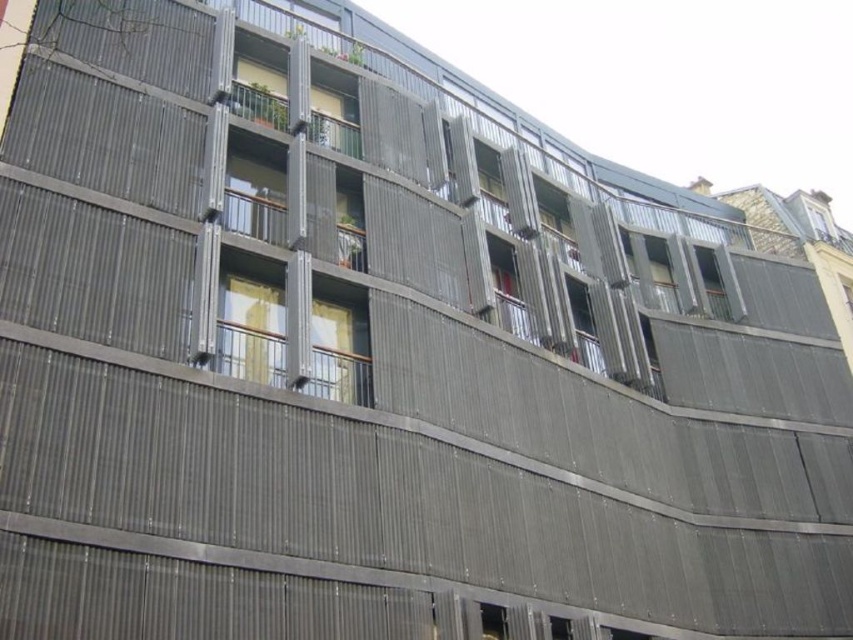
The width and height of the screenshot is (853, 640). What do you see at coordinates (820, 220) in the screenshot?
I see `clear glass window at upper right` at bounding box center [820, 220].

The image size is (853, 640). Identify the location of clear glass window at upper right. (820, 220).

Is transparent glass window at lower center above white glossy window at center?

Incorrect, transparent glass window at lower center is not positioned above white glossy window at center.

This screenshot has width=853, height=640. I want to click on transparent glass window at lower center, so click(492, 621).

Where is `transparent glass window at lower center`? The width and height of the screenshot is (853, 640). transparent glass window at lower center is located at coordinates (492, 621).

This screenshot has width=853, height=640. Describe the element at coordinates (260, 93) in the screenshot. I see `matte gray window at upper center` at that location.

Does matte gray window at upper center appear on the right side of white glossy window at center?

Incorrect, matte gray window at upper center is not on the right side of white glossy window at center.

Which is behind, point (258, 83) or point (846, 307)?

Positioned behind is point (846, 307).

Identify the location of matte gray window at upper center. (260, 93).